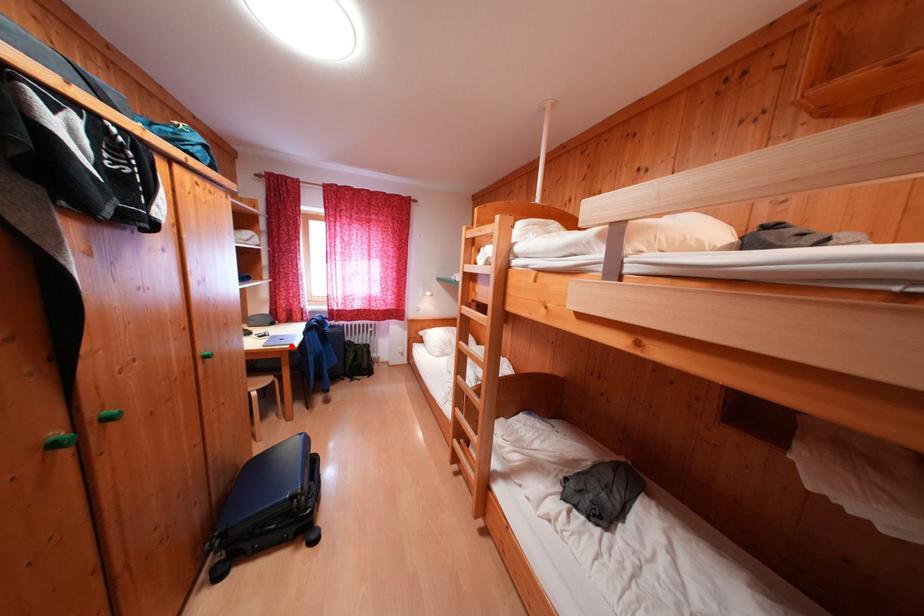
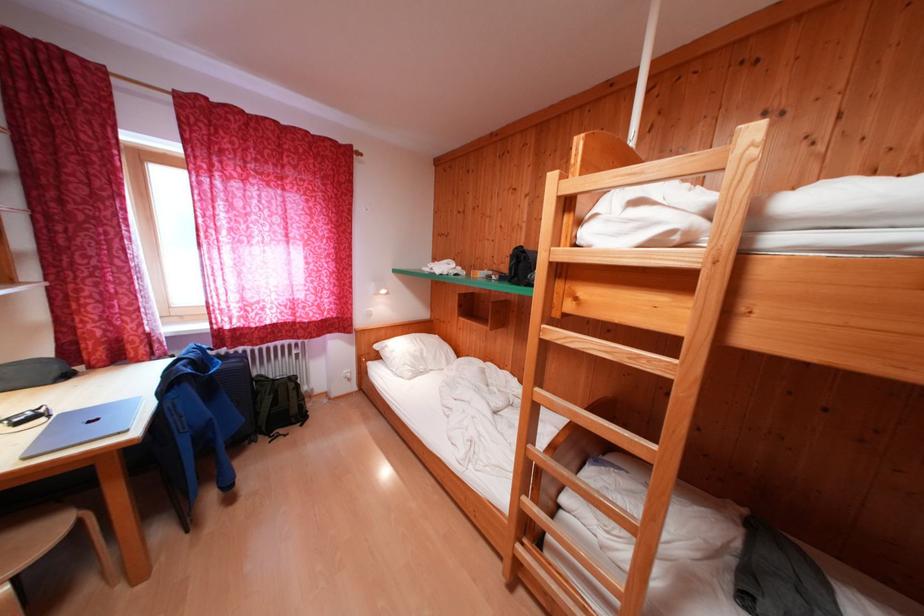
Question: I am providing you with two images of the same scene from different viewpoints. In image1, a red point is highlighted. Considering the same 3D point in image2, which of the following is correct?

Choices:
 (A) It is closer
 (B) It is farther

Answer: (B)